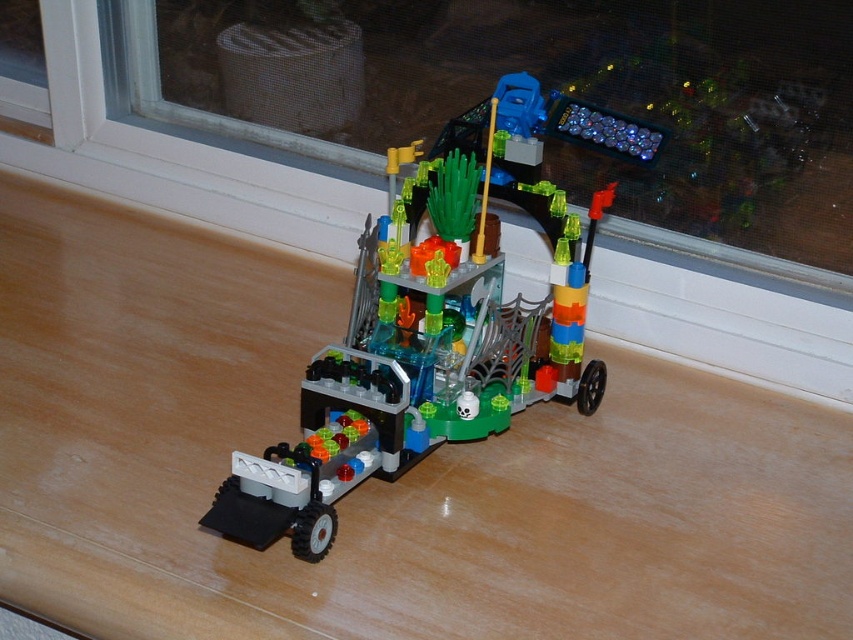
Is point (550, 99) less distant than point (131, 4)?

Yes.

Does point (258, 524) lie behind point (144, 38)?

No, it is in front of (144, 38).

What are the coordinates of `translucent plastic vehicle at center` in the screenshot? It's located at (438, 324).